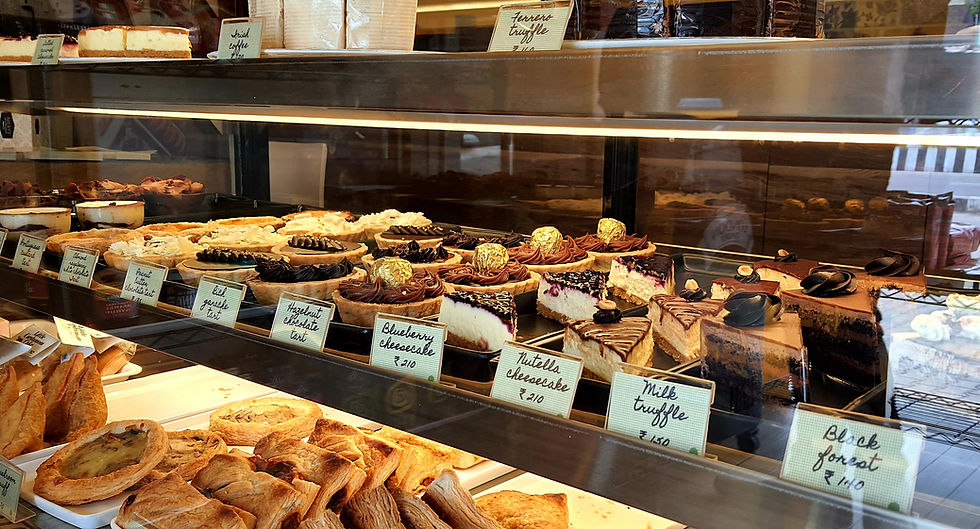
This screenshot has height=529, width=980. Identify the location of display case. (741, 168).